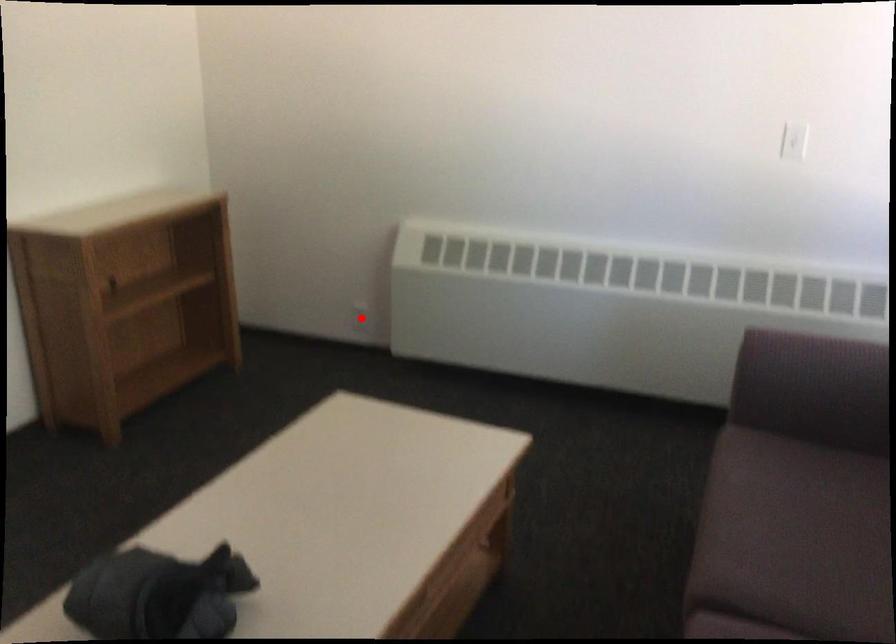
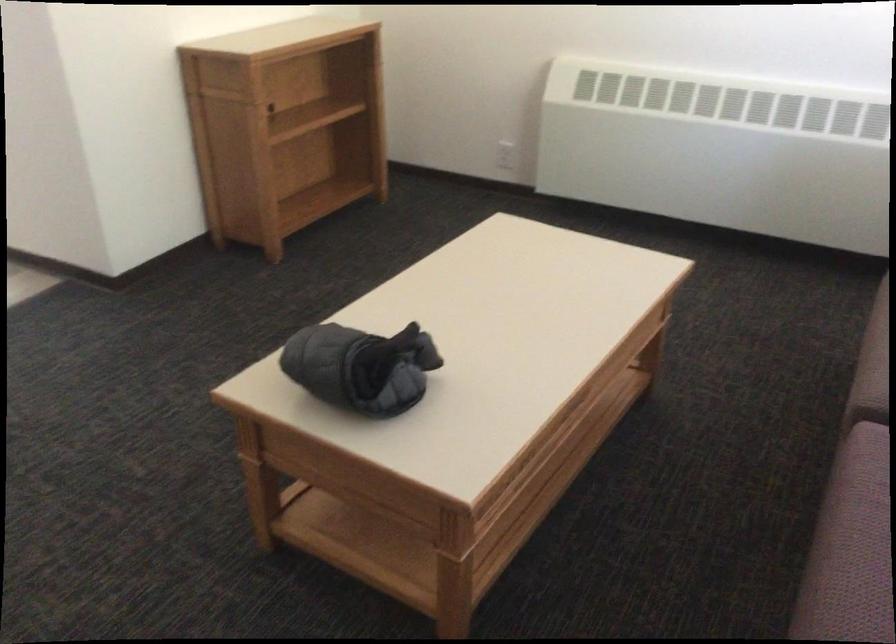
The point at the highlighted location is marked in the first image. Where is the corresponding point in the second image?

(505, 155)